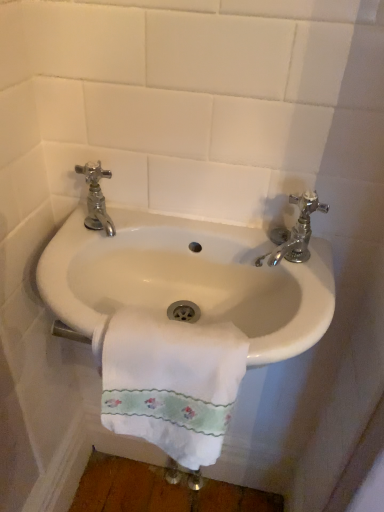
Question: Can you confirm if chrome/metallic faucet at right, marked as the 1th tap in a right-to-left arrangement, is wider than chrome/metallic faucet at upper left, the 2th tap when ordered from right to left?

Choices:
 (A) no
 (B) yes

Answer: (A)

Question: Does chrome/metallic faucet at right, the 2th tap positioned from the left, turn towards chrome/metallic faucet at upper left, arranged as the 1th tap when viewed from the left?

Choices:
 (A) yes
 (B) no

Answer: (B)

Question: From the image's perspective, is chrome/metallic faucet at right, marked as the 1th tap in a right-to-left arrangement, below chrome/metallic faucet at upper left, arranged as the 1th tap when viewed from the left?

Choices:
 (A) no
 (B) yes

Answer: (B)

Question: Considering the relative sizes of chrome/metallic faucet at right, the 2th tap positioned from the left, and chrome/metallic faucet at upper left, the 2th tap when ordered from right to left, in the image provided, is chrome/metallic faucet at right, the 2th tap positioned from the left, smaller than chrome/metallic faucet at upper left, the 2th tap when ordered from right to left,?

Choices:
 (A) no
 (B) yes

Answer: (B)

Question: Is chrome/metallic faucet at right, marked as the 1th tap in a right-to-left arrangement, bigger than chrome/metallic faucet at upper left, arranged as the 1th tap when viewed from the left?

Choices:
 (A) no
 (B) yes

Answer: (A)

Question: From the image's perspective, is white cotton towel at center positioned above or below white glossy sink at center?

Choices:
 (A) below
 (B) above

Answer: (A)

Question: From a real-world perspective, is white cotton towel at center above or below white glossy sink at center?

Choices:
 (A) above
 (B) below

Answer: (B)

Question: Looking at their shapes, would you say white cotton towel at center is wider or thinner than white glossy sink at center?

Choices:
 (A) thin
 (B) wide

Answer: (A)

Question: Considering their positions, is white cotton towel at center located in front of or behind white glossy sink at center?

Choices:
 (A) behind
 (B) front

Answer: (B)

Question: Which is correct: chrome/metallic faucet at upper left, the 2th tap when ordered from right to left, is inside chrome/metallic faucet at right, marked as the 1th tap in a right-to-left arrangement, or outside of it?

Choices:
 (A) outside
 (B) inside

Answer: (A)

Question: Based on their sizes in the image, would you say chrome/metallic faucet at upper left, arranged as the 1th tap when viewed from the left, is bigger or smaller than chrome/metallic faucet at right, marked as the 1th tap in a right-to-left arrangement?

Choices:
 (A) big
 (B) small

Answer: (A)

Question: Is point (104, 204) positioned closer to the camera than point (269, 233)?

Choices:
 (A) closer
 (B) farther

Answer: (B)

Question: Relative to chrome/metallic faucet at right, marked as the 1th tap in a right-to-left arrangement, is chrome/metallic faucet at upper left, arranged as the 1th tap when viewed from the left, in front or behind?

Choices:
 (A) behind
 (B) front

Answer: (A)

Question: From the image's perspective, is white cotton towel at center above or below chrome/metallic faucet at upper left, arranged as the 1th tap when viewed from the left?

Choices:
 (A) below
 (B) above

Answer: (A)

Question: Is white cotton towel at center situated inside chrome/metallic faucet at upper left, the 2th tap when ordered from right to left, or outside?

Choices:
 (A) inside
 (B) outside

Answer: (B)